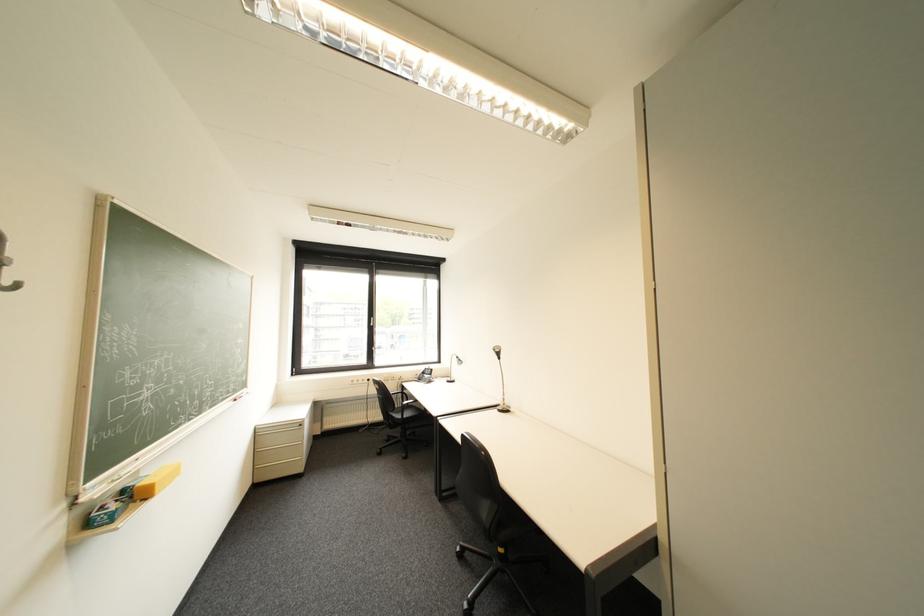
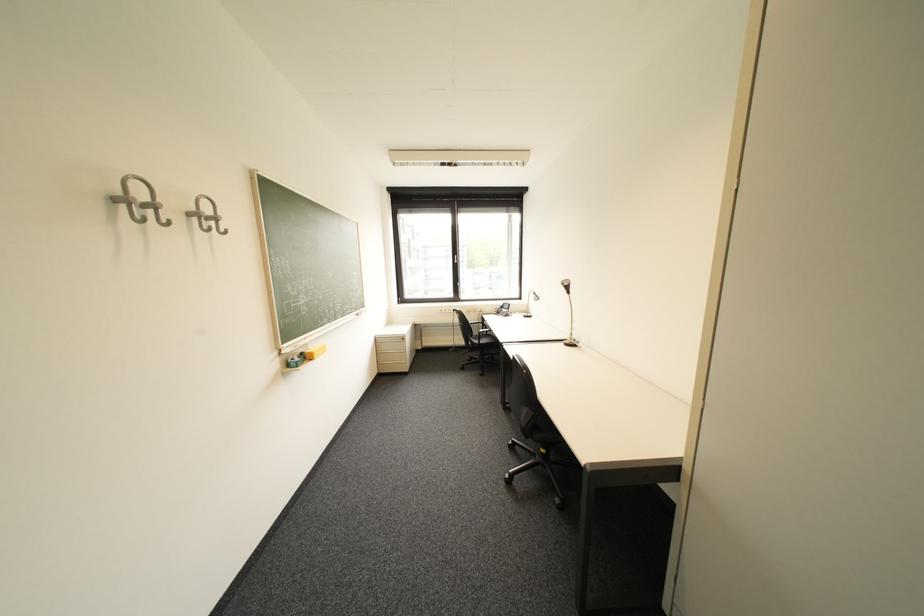
Locate, in the second image, the point that corresponds to the point at 505,411 in the first image.

(572, 345)